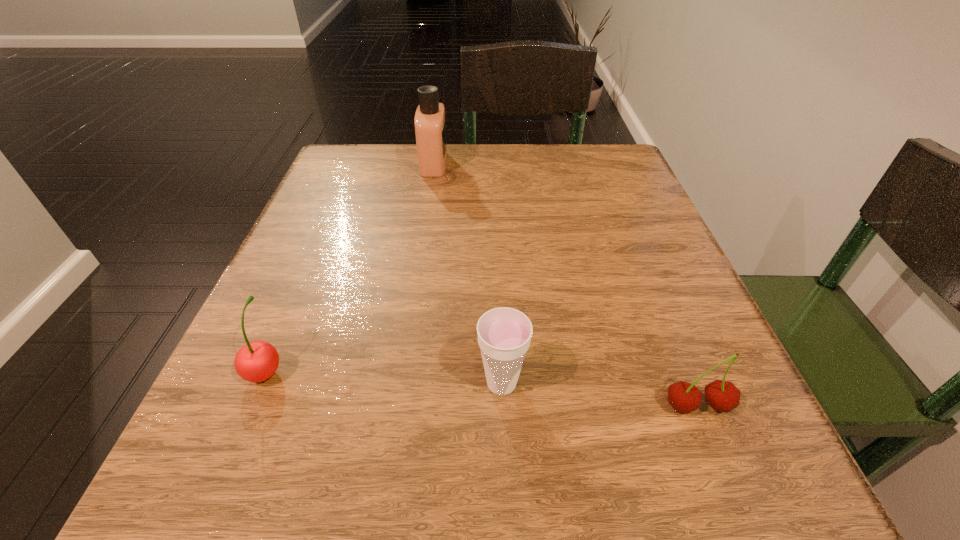
Where is `blank space located 0.060m on the surface of the right cherry`? blank space located 0.060m on the surface of the right cherry is located at coordinates (723, 470).

Image resolution: width=960 pixels, height=540 pixels. Identify the location of object at the far edge. (430, 122).

Locate an element on the screen. This screenshot has width=960, height=540. object that is positioned at the left edge is located at coordinates (257, 361).

Where is `object that is at the right edge`? The width and height of the screenshot is (960, 540). object that is at the right edge is located at coordinates (724, 396).

Locate an element on the screen. The height and width of the screenshot is (540, 960). free space at the far edge of the desktop is located at coordinates (491, 154).

Identify the location of vacant area at the near edge. This screenshot has width=960, height=540. (429, 507).

The image size is (960, 540). I want to click on blank space at the left edge of the desktop, so click(x=342, y=226).

At what (x,y) coordinates should I click in order to perform the action: click on free space at the right edge of the desktop. Please return your answer as a coordinate pair (x, y). Looking at the image, I should click on (594, 305).

What are the coordinates of `vacant space at the far left corner of the desktop` in the screenshot? It's located at (335, 152).

Find the location of a particular element. vacant space at the far right corner of the desktop is located at coordinates (561, 146).